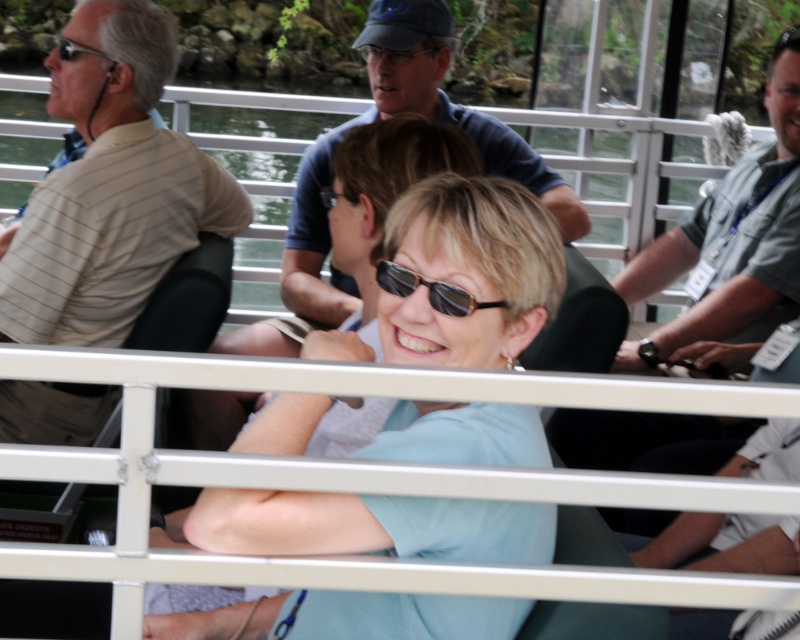
Find the location of a particular element. This screenshot has width=800, height=640. gray fabric shirt at right is located at coordinates (740, 284).

Between gray fabric shirt at right and black plastic sunglasses at center, which one is positioned higher?

gray fabric shirt at right is above.

Does point (733, 300) come behind point (405, 275)?

Yes.

Where is `gray fabric shirt at right`? This screenshot has height=640, width=800. gray fabric shirt at right is located at coordinates (740, 284).

Who is more forward, [110,92] or [682,262]?

Point [110,92]

Is beige striped shirt at left bigger than gray fabric shirt at right?

Actually, beige striped shirt at left might be smaller than gray fabric shirt at right.

Which is in front, point (158, 152) or point (760, 326)?

Point (158, 152) is in front.

Find the location of a particular element. Image resolution: width=800 pixels, height=640 pixels. beige striped shirt at left is located at coordinates click(110, 188).

Who is more forward, (120, 221) or (470, 308)?

Point (470, 308) is more forward.

Is beige striped shirt at left positioned in front of black plastic sunglasses at center?

No, it is behind black plastic sunglasses at center.

Between point (108, 218) and point (381, 260), which one is positioned behind?

Positioned behind is point (108, 218).

In order to click on beige striped shirt at left in this screenshot , I will do pyautogui.click(x=110, y=188).